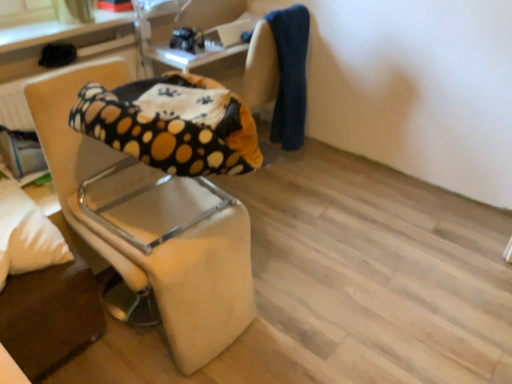
Question: Does white soft pillow at lower left lie behind beige fabric chair at left?

Choices:
 (A) yes
 (B) no

Answer: (A)

Question: From a real-world perspective, is white soft pillow at lower left on beige fabric chair at left?

Choices:
 (A) no
 (B) yes

Answer: (B)

Question: Does white soft pillow at lower left have a larger size compared to beige fabric chair at left?

Choices:
 (A) yes
 (B) no

Answer: (B)

Question: Is the surface of white soft pillow at lower left in direct contact with beige fabric chair at left?

Choices:
 (A) yes
 (B) no

Answer: (B)

Question: Can you confirm if white soft pillow at lower left is taller than beige fabric chair at left?

Choices:
 (A) no
 (B) yes

Answer: (A)

Question: Is beige fabric chair at left at the back of white soft pillow at lower left?

Choices:
 (A) no
 (B) yes

Answer: (A)

Question: Does beige fabric chair at left come behind white soft pillow at lower left?

Choices:
 (A) yes
 (B) no

Answer: (B)

Question: Is beige fabric chair at left turned away from white soft pillow at lower left?

Choices:
 (A) no
 (B) yes

Answer: (A)

Question: From the image's perspective, does beige fabric chair at left appear higher than white soft pillow at lower left?

Choices:
 (A) yes
 (B) no

Answer: (A)

Question: Is beige fabric chair at left directly adjacent to white soft pillow at lower left?

Choices:
 (A) yes
 (B) no

Answer: (B)

Question: Are beige fabric chair at left and white soft pillow at lower left far apart?

Choices:
 (A) yes
 (B) no

Answer: (B)

Question: Considering the relative positions of beige fabric chair at left and white soft pillow at lower left in the image provided, is beige fabric chair at left to the right of white soft pillow at lower left from the viewer's perspective?

Choices:
 (A) no
 (B) yes

Answer: (B)

Question: Relative to white soft pillow at lower left, is beige fabric chair at left in front or behind?

Choices:
 (A) front
 (B) behind

Answer: (A)